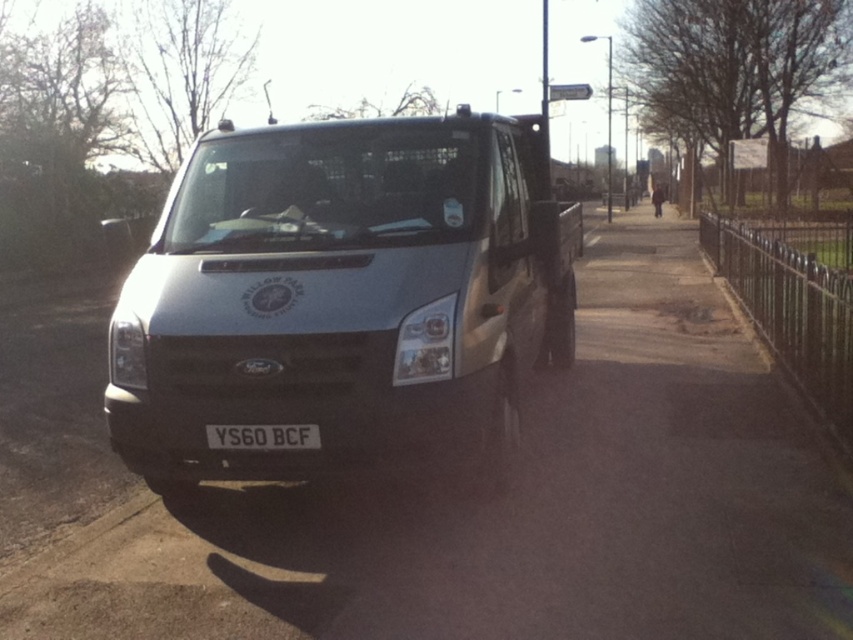
Does point (271, 472) lie behind point (276, 442)?

Yes, point (271, 472) is behind point (276, 442).

Who is higher up, silver metallic van at center or black plastic license plate at center?

Positioned higher is silver metallic van at center.

Is point (555, 300) positioned before point (264, 435)?

No, it is behind (264, 435).

Locate an element on the screen. This screenshot has height=640, width=853. silver metallic van at center is located at coordinates (341, 292).